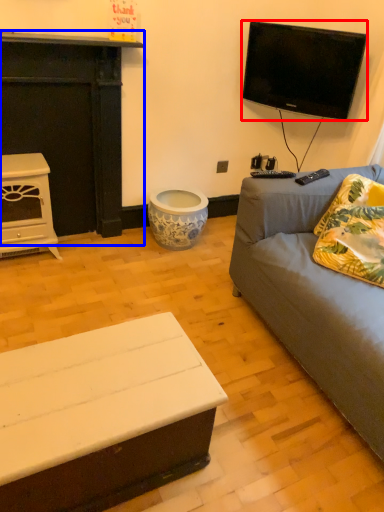
Question: Which of the following is the closest to the observer, television (highlighted by a red box) or fireplace (highlighted by a blue box)?

Choices:
 (A) television
 (B) fireplace

Answer: (B)